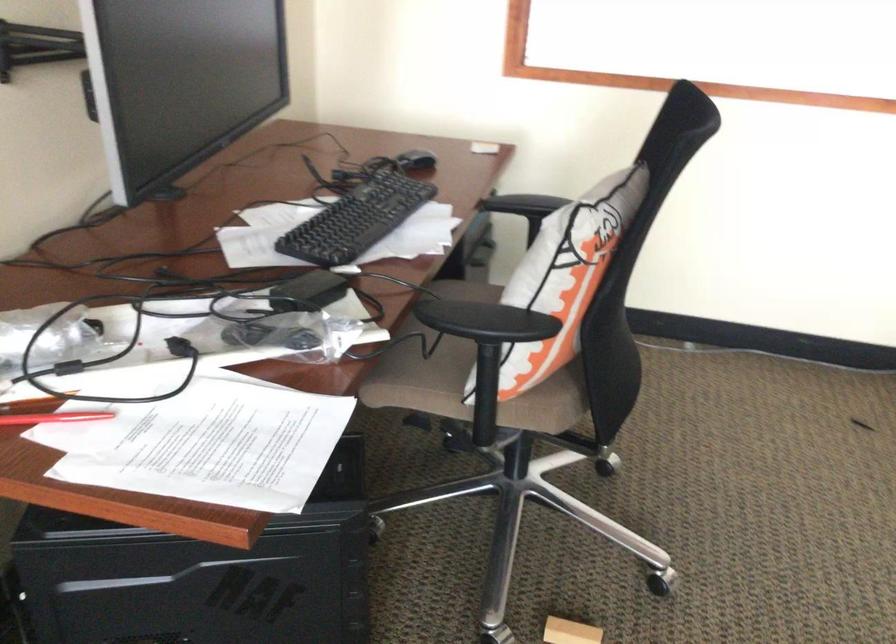
Where would you resting arm the chair armrest? Please return your answer as a coordinate pair (x, y).

(522, 204)